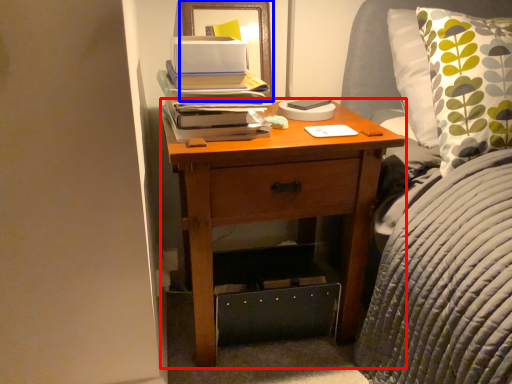
Question: Which of the following is the closest to the observer, nightstand (highlighted by a red box) or picture frame (highlighted by a blue box)?

Choices:
 (A) nightstand
 (B) picture frame

Answer: (A)